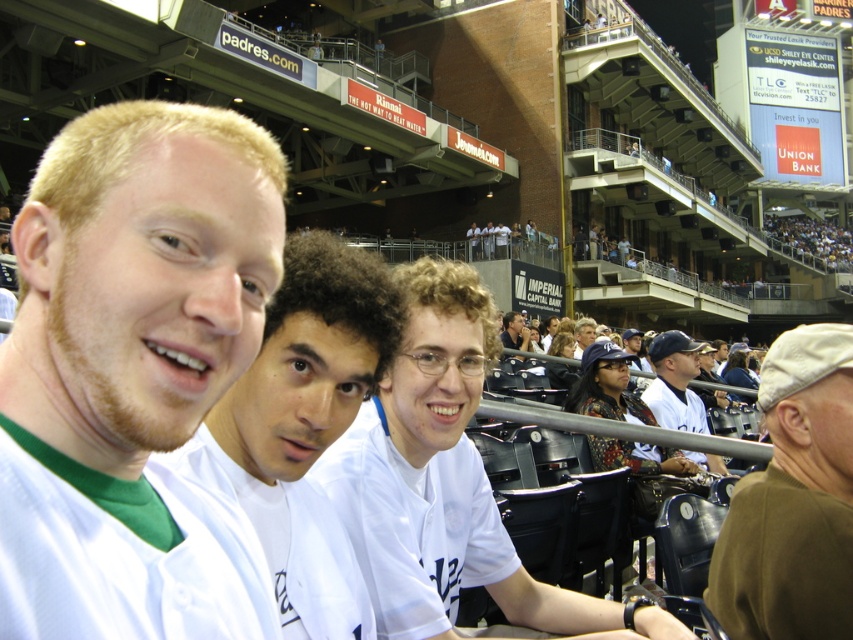
Which is in front, point (38, 502) or point (512, 326)?

Point (38, 502)

Is matte white jersey at center shorter than matte white shirt at center?

In fact, matte white jersey at center may be taller than matte white shirt at center.

This screenshot has width=853, height=640. What do you see at coordinates (129, 365) in the screenshot? I see `matte white jersey at center` at bounding box center [129, 365].

Find the location of `matte white jersey at center`. matte white jersey at center is located at coordinates (129, 365).

Which of these two, brown cotton cap at right or matte white shirt at center, stands taller?

With more height is brown cotton cap at right.

Is point (770, 397) positioned after point (521, 348)?

No, it is in front of (521, 348).

I want to click on brown cotton cap at right, so click(x=793, y=499).

Is point (4, 397) positioned behind point (692, 342)?

That is False.

Does matte white jersey at center lie behind white baseball cap at upper right?

No.

Does point (177, 534) lie in front of point (694, 408)?

Yes.

I want to click on matte white jersey at center, so click(129, 365).